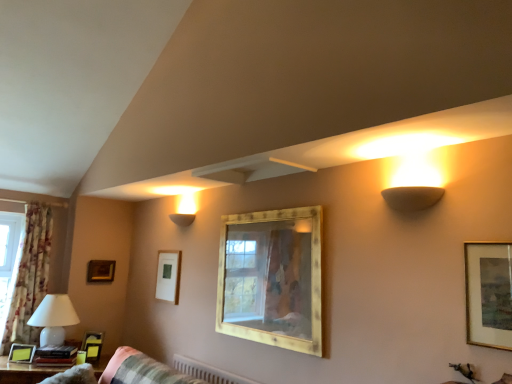
Question: Would you say matte black picture frame at lower left, which is the third picture frame from left to right, contains wooden mirror at center, the second picture frame from the right?

Choices:
 (A) yes
 (B) no

Answer: (B)

Question: Can you confirm if matte black picture frame at lower left, the 3th picture frame positioned from the back, is positioned to the left of wooden mirror at center, the second picture frame from the right?

Choices:
 (A) yes
 (B) no

Answer: (A)

Question: From the image's perspective, does matte black picture frame at lower left, the 3th picture frame positioned from the back, appear higher than wooden mirror at center, the second picture frame from the right?

Choices:
 (A) no
 (B) yes

Answer: (A)

Question: Considering the relative sizes of matte black picture frame at lower left, which is the third picture frame from left to right, and wooden mirror at center, the 5th picture frame from the left, in the image provided, is matte black picture frame at lower left, which is the third picture frame from left to right, shorter than wooden mirror at center, the 5th picture frame from the left,?

Choices:
 (A) no
 (B) yes

Answer: (B)

Question: Does matte black picture frame at lower left, the 3th picture frame positioned from the back, have a larger size compared to wooden mirror at center, acting as the 5th picture frame starting from the back?

Choices:
 (A) yes
 (B) no

Answer: (B)

Question: Does matte black picture frame at lower left, which is the third picture frame from left to right, have a smaller size compared to wooden mirror at center, acting as the second picture frame starting from the front?

Choices:
 (A) no
 (B) yes

Answer: (B)

Question: Is floral fabric curtain at left facing away from wooden frame at upper left, which is counted as the sixth picture frame, starting from the front?

Choices:
 (A) yes
 (B) no

Answer: (B)

Question: Considering the relative sizes of floral fabric curtain at left and wooden frame at upper left, the 1th picture frame in the back-to-front sequence, in the image provided, is floral fabric curtain at left thinner than wooden frame at upper left, the 1th picture frame in the back-to-front sequence,?

Choices:
 (A) yes
 (B) no

Answer: (B)

Question: Can you confirm if floral fabric curtain at left is taller than wooden frame at upper left, the 1th picture frame in the back-to-front sequence?

Choices:
 (A) yes
 (B) no

Answer: (A)

Question: Is floral fabric curtain at left aimed at wooden frame at upper left, which is the second picture frame from left to right?

Choices:
 (A) no
 (B) yes

Answer: (A)

Question: Is floral fabric curtain at left not within wooden frame at upper left, which is counted as the sixth picture frame, starting from the front?

Choices:
 (A) yes
 (B) no

Answer: (A)

Question: Considering the relative sizes of floral fabric curtain at left and wooden frame at upper left, which is counted as the sixth picture frame, starting from the front, in the image provided, is floral fabric curtain at left shorter than wooden frame at upper left, which is counted as the sixth picture frame, starting from the front,?

Choices:
 (A) no
 (B) yes

Answer: (A)

Question: Is wooden table at lower left smaller than wooden frame at upper left, which is counted as the sixth picture frame, starting from the front?

Choices:
 (A) yes
 (B) no

Answer: (B)